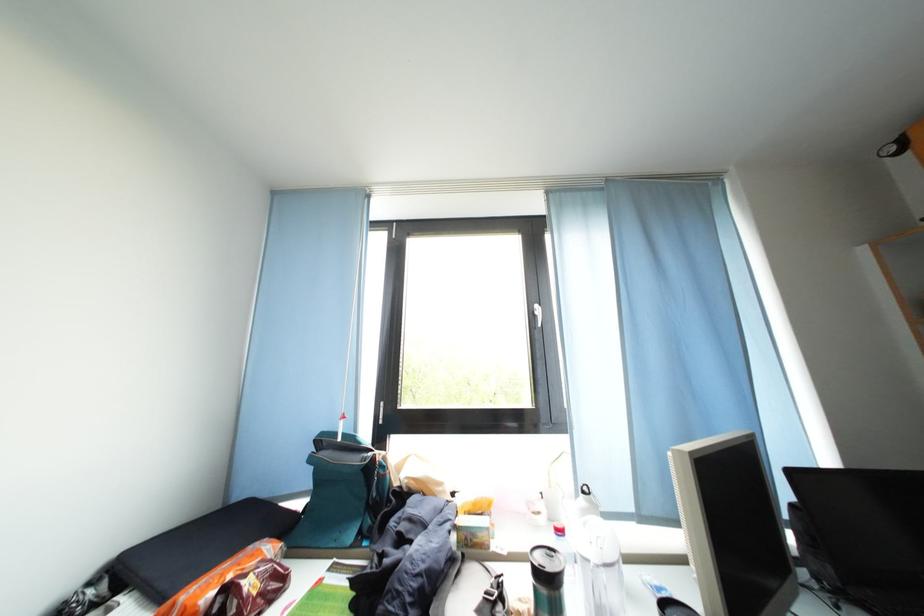
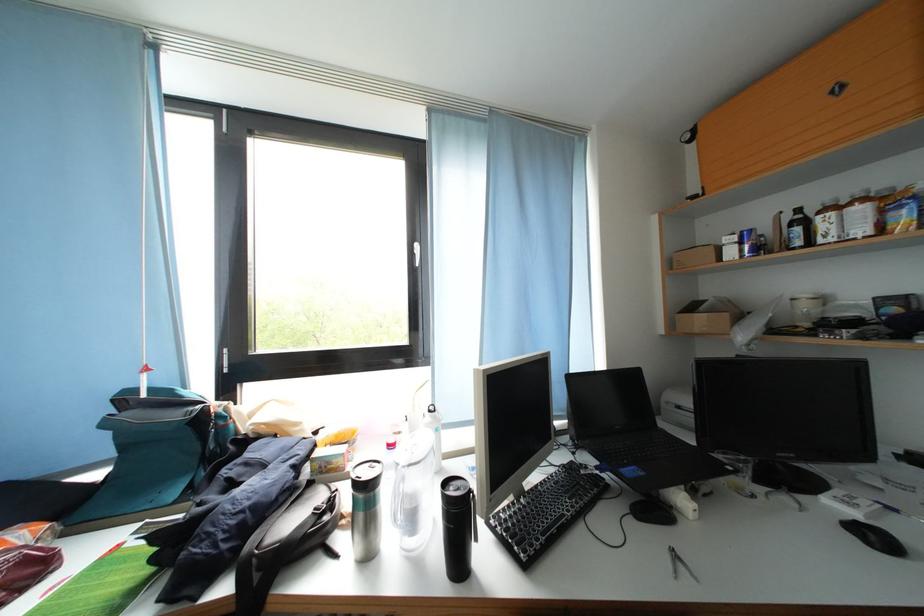
Question: What movement of the cameraman would produce the second image?

Choices:
 (A) Left
 (B) Right
 (C) Forward
 (D) Backward

Answer: (B)